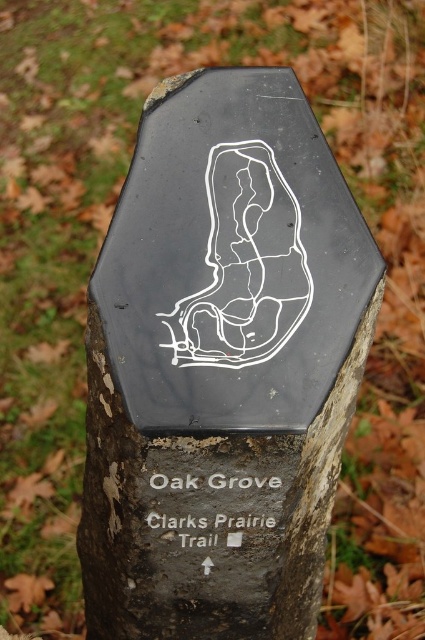
Is point (166, 609) positioned behind point (226, 536)?

Yes, point (166, 609) is behind point (226, 536).

Consider the image. Measure the distance from black rough tree trunk at center to whitematerial/texturetext at center.

black rough tree trunk at center and whitematerial/texturetext at center are 8.27 inches apart.

The width and height of the screenshot is (425, 640). Describe the element at coordinates (221, 365) in the screenshot. I see `black rough tree trunk at center` at that location.

Where is `black rough tree trunk at center`? This screenshot has height=640, width=425. black rough tree trunk at center is located at coordinates (221, 365).